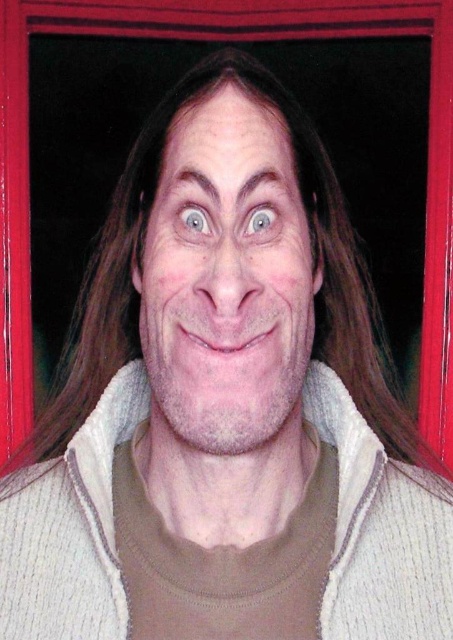
Question: Can you confirm if white textured sweater at center is wider than light blue glossy eye at center?

Choices:
 (A) yes
 (B) no

Answer: (A)

Question: Can you confirm if smooth skin face at center is wider than blue glossy eye at center?

Choices:
 (A) yes
 (B) no

Answer: (A)

Question: Which point appears farthest from the camera in this image?

Choices:
 (A) (261, 205)
 (B) (203, 221)
 (C) (4, 522)
 (D) (210, 317)

Answer: (C)

Question: Among these objects, which one is nearest to the camera?

Choices:
 (A) light blue glossy eye at center
 (B) blue glossy eye at center
 (C) white textured sweater at center

Answer: (A)

Question: Does smooth skin face at center lie behind white textured sweater at center?

Choices:
 (A) no
 (B) yes

Answer: (A)

Question: Which object appears closest to the camera in this image?

Choices:
 (A) light blue glossy eye at center
 (B) blue glossy eye at center
 (C) white textured sweater at center

Answer: (A)